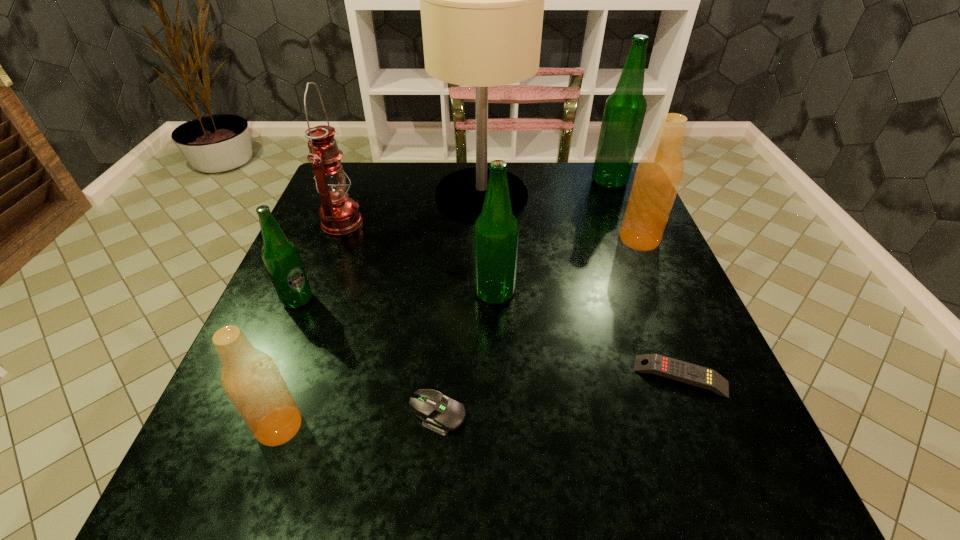
At what (x,y) coordinates should I click in order to perform the action: click on vacant region between the table lamp and the computer mouse. Please return your answer as a coordinate pair (x, y). The width and height of the screenshot is (960, 540). Looking at the image, I should click on (x=460, y=305).

Identify the location of unoccupied position between the leftmost green beer bottle and the third beer bottle from right to left. This screenshot has width=960, height=540. (396, 296).

This screenshot has width=960, height=540. Find the location of `empty space that is in between the third beer bottle from left to right and the computer mouse`. empty space that is in between the third beer bottle from left to right and the computer mouse is located at coordinates click(466, 354).

This screenshot has height=540, width=960. Find the location of `free space between the biggest green beer bottle and the smallest green beer bottle`. free space between the biggest green beer bottle and the smallest green beer bottle is located at coordinates (453, 240).

The height and width of the screenshot is (540, 960). Identify the location of free spot between the table lamp and the computer mouse. (460, 305).

Identify the location of unoccupied area between the second green beer bottle from left to right and the yellow remote control. This screenshot has height=540, width=960. (588, 335).

Locate an element on the screen. vacant point located between the gray computer mouse and the right tan beer bottle is located at coordinates (539, 327).

Image resolution: width=960 pixels, height=540 pixels. I want to click on unoccupied area between the yellow remote control and the oil lamp, so [x=512, y=300].

At what (x,y) coordinates should I click in order to perform the action: click on object that stands as the eighth closest to the yellow remote control. Please return your answer as a coordinate pair (x, y). The image size is (960, 540). Looking at the image, I should click on (339, 214).

The height and width of the screenshot is (540, 960). What are the coordinates of `object that is the fourth closest to the computer mouse` in the screenshot? It's located at (280, 255).